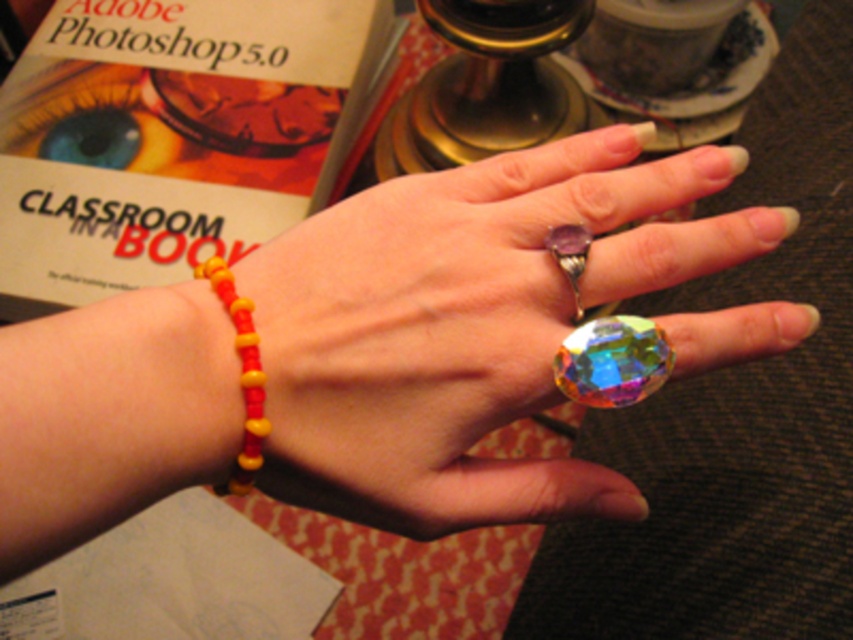
You are designing a piece of jewelry and need to determine the placement of elements. Given the multicolored glass ring at center and the yellow matte beads at lower left, which object would be more suitable for a central focal point in a necklace design, and why?

The multicolored glass ring at center is larger in size than the yellow matte beads at lower left, making it more suitable as a central focal point in a necklace design due to its prominence and visual impact.

You are an artist trying to place a sticker exactly at the center of the multicolored glass ring at center. According to the image, what are the coordinates where you should place the sticker?

The coordinates for the multicolored glass ring at center are at point (x=445, y=333), so you should place the sticker at those coordinates.

You are an appraiser evaluating two rings on a hand. The multicolored glass ring at center and the purple gemstone ring at center. Which ring has a bigger size?

The multicolored glass ring at center has a larger size compared to the purple gemstone ring at center.